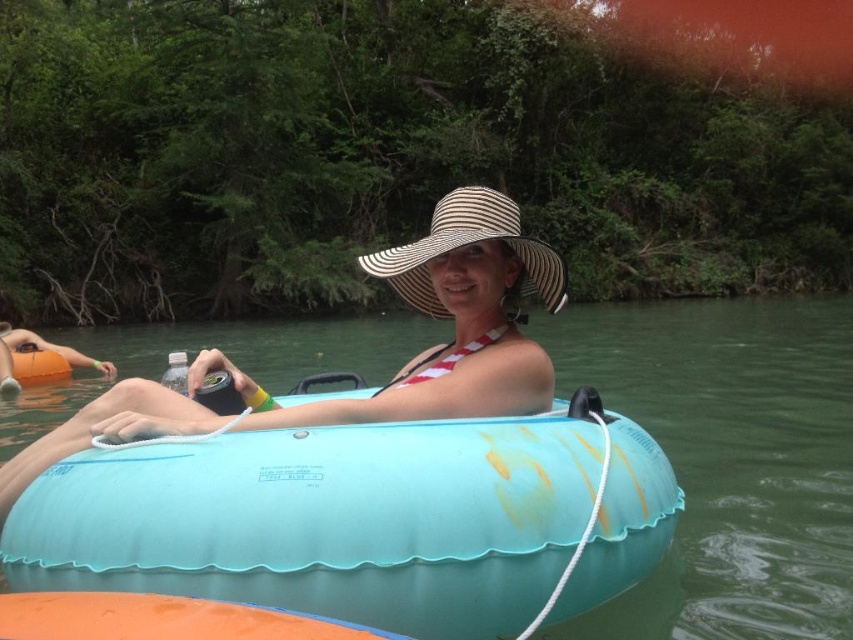
Question: Which of these objects is positioned farthest from the matte blue tube at center?

Choices:
 (A) white striped straw hat at center
 (B) light blue rubber ring at center

Answer: (A)

Question: Can you confirm if matte blue tube at center is thinner than white striped straw hat at center?

Choices:
 (A) yes
 (B) no

Answer: (A)

Question: Which object is the closest to the light blue rubber ring at center?

Choices:
 (A) matte blue tube at center
 (B) white striped straw hat at center

Answer: (A)

Question: Is light blue rubber ring at center positioned in front of white striped straw hat at center?

Choices:
 (A) no
 (B) yes

Answer: (B)

Question: Among these objects, which one is nearest to the camera?

Choices:
 (A) matte blue tube at center
 (B) light blue rubber ring at center

Answer: (B)

Question: Does light blue rubber ring at center have a larger size compared to white striped straw hat at center?

Choices:
 (A) no
 (B) yes

Answer: (A)